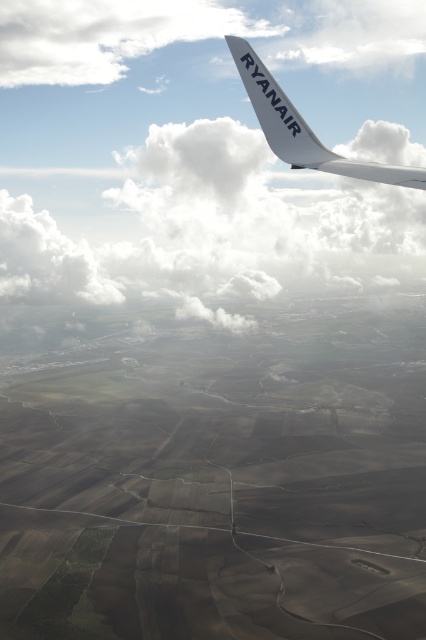
You are a flight attendant on a Ryanair flight. You look out the window and see the white matte ryanair winglet at upper right and the white matte wing at upper center. Which of these two objects appears bigger in the view?

The white matte ryanair winglet at upper right appears bigger because it has a larger size compared to the white matte wing at upper center.

You are a pilot looking at the view from the airplane window. You notice a white fluffy cloud at upper center and a white matte wing at upper center. Which object is wider?

The white fluffy cloud at upper center is wider than the white matte wing at upper center.

You are a passenger sitting at the window seat and looking out. You see the white fluffy cloud at upper center and the white matte ryanair winglet at upper right. Which object is higher in the sky?

The white fluffy cloud at upper center has a greater height compared to the white matte ryanair winglet at upper right, so the white fluffy cloud at upper center is higher in the sky.